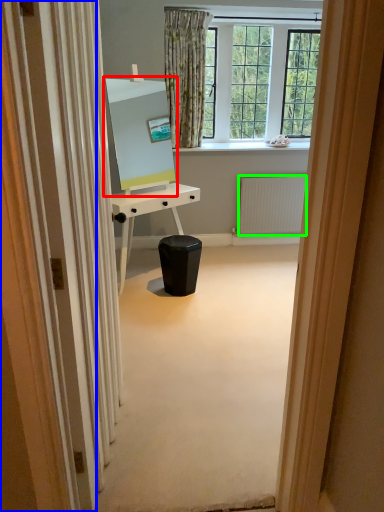
Question: Estimate the real-world distances between objects in this image. Which object is closer to computer monitor (highlighted by a red box), screen door (highlighted by a blue box) or radiator (highlighted by a green box)?

Choices:
 (A) screen door
 (B) radiator

Answer: (B)